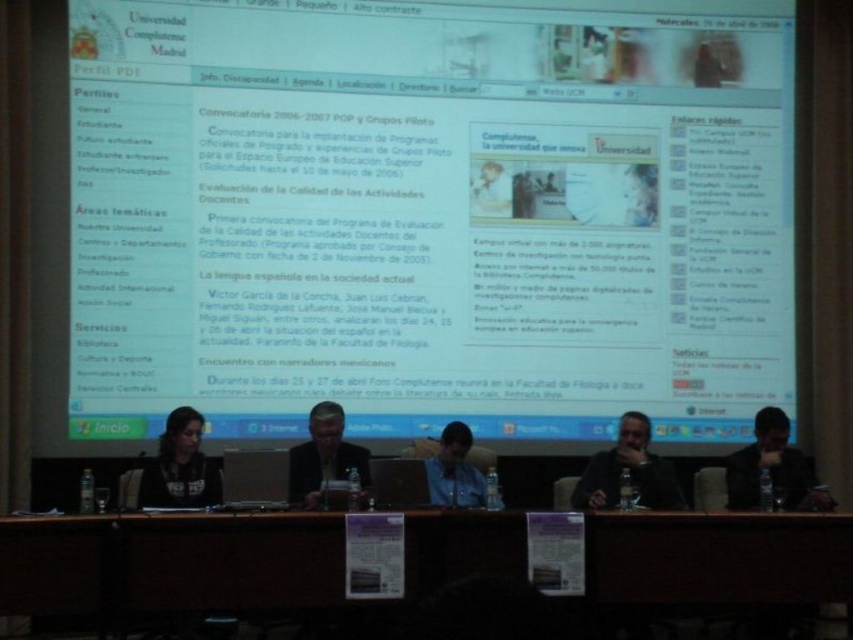
You are organizing a university event and need to place a 10 feet wide banner between the matte black shirt at lower left and the dark gray jacket at upper center. Is there enough space between them to fit the banner?

The distance between the matte black shirt at lower left and the dark gray jacket at upper center is 19.42 feet, so yes, the banner can be placed between them as the space is larger than the banner width.

You are attending a lecture at Universidad Complutense de Madrid and notice the white glossy screen at upper center and the blue shirt at center. Which object is positioned higher in the image?

The white glossy screen at upper center is positioned higher than the blue shirt at center.

In the scene shown: You are a student attending a lecture at the university. You notice a matte black shirt at lower left and a dark gray jacket at upper center. Which clothing item is located more to the left in the image?

The matte black shirt at lower left is positioned on the left side of dark gray jacket at upper center, so the matte black shirt at lower left is more to the left.